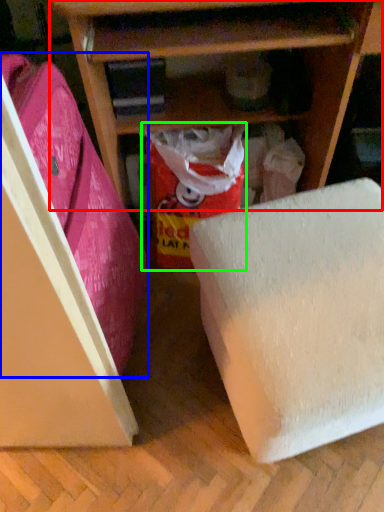
Question: Which is nearer to the shelf (highlighted by a red box)? leftover (highlighted by a blue box) or wrapping paper (highlighted by a green box).

Choices:
 (A) leftover
 (B) wrapping paper

Answer: (B)